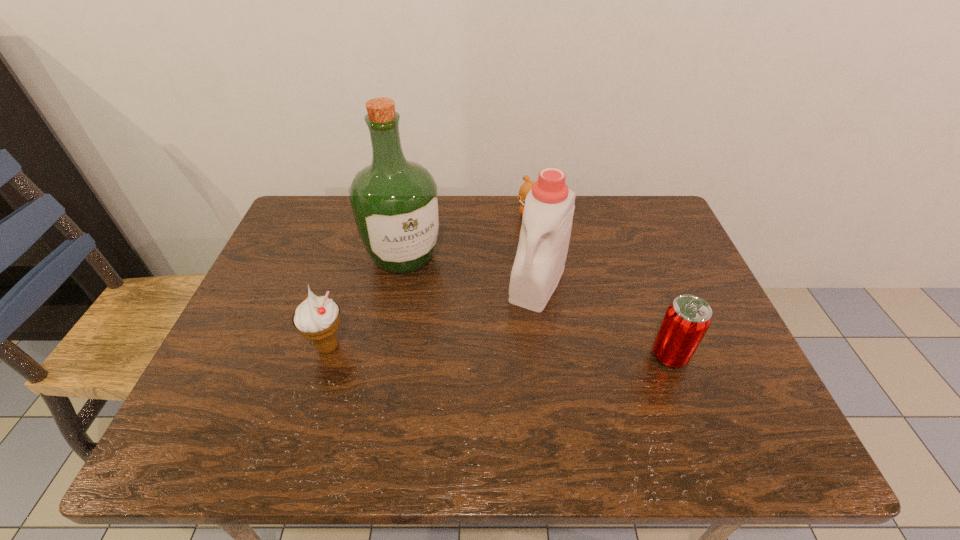
At what (x,y) coordinates should I click in order to perform the action: click on vacant space on the desktop that is between the icecream and the rightmost object and is positioned on the front-facing side of the liquor. Please return your answer as a coordinate pair (x, y). The width and height of the screenshot is (960, 540). Looking at the image, I should click on (462, 350).

Where is `free space on the desktop that is between the icecream and the rightmost object and is positioned on the face of the farthest object`? free space on the desktop that is between the icecream and the rightmost object and is positioned on the face of the farthest object is located at coordinates (503, 351).

Identify the location of free spot on the desktop that is between the icecream and the soda can and is positioned on the handle side of the fourth shortest object. The width and height of the screenshot is (960, 540). (502, 351).